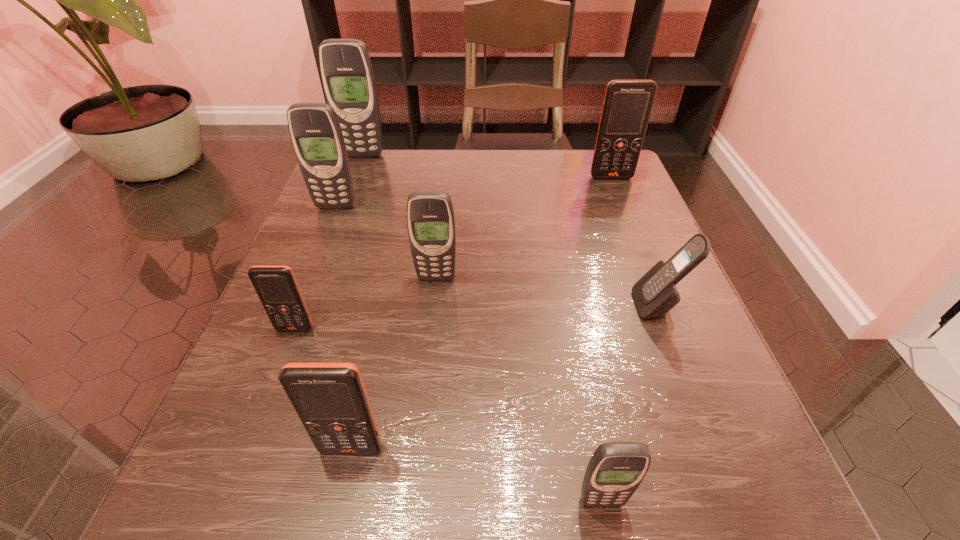
Image resolution: width=960 pixels, height=540 pixels. Find the location of `the fifth farthest cellular telephone`. the fifth farthest cellular telephone is located at coordinates click(x=655, y=294).

Locate an element on the screen. The height and width of the screenshot is (540, 960). the sixth farthest object is located at coordinates (276, 286).

At what (x,y) coordinates should I click in order to perform the action: click on the smallest orange cellular telephone. Please return your answer as a coordinate pair (x, y). This screenshot has width=960, height=540. Looking at the image, I should click on (x=276, y=286).

Find the location of `the nearest object`. the nearest object is located at coordinates (615, 471).

Find the location of a particular element. The width and height of the screenshot is (960, 540). the sixth object from left to right is located at coordinates (615, 471).

The image size is (960, 540). I want to click on vacant space located 0.310m on the screen of the farthest cellular telephone, so click(x=333, y=236).

The image size is (960, 540). I want to click on free spot located 0.070m on the screen of the second farthest object, so click(619, 197).

The image size is (960, 540). Find the location of `free spot located on the screen of the third smallest gray cellular telephone`. free spot located on the screen of the third smallest gray cellular telephone is located at coordinates tap(324, 236).

Identify the location of free location located on the screen of the fifth nearest cellular telephone. (421, 422).

The height and width of the screenshot is (540, 960). In order to click on free space located 0.050m on the screen of the seventh farthest object in this screenshot , I will do `click(341, 498)`.